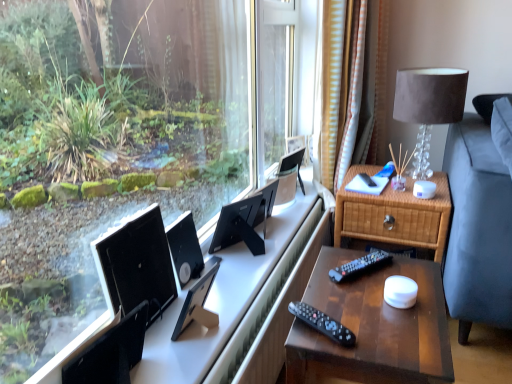
Find the location of a particular element. vacant space in front of black matte computer monitor at center, arranged as the 1th computer monitor when viewed from the back is located at coordinates (234, 279).